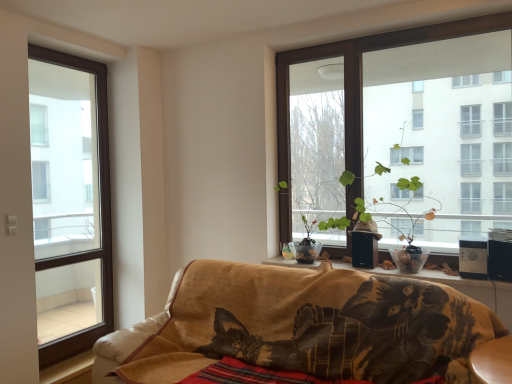
Question: Is brown wooden window at upper right, acting as the 1th window starting from the right, facing away from brown wood window at left, which ranks as the 1th window in left-to-right order?

Choices:
 (A) yes
 (B) no

Answer: (B)

Question: Is brown wooden window at upper right, acting as the 1th window starting from the right, oriented towards brown wood window at left, which ranks as the 1th window in left-to-right order?

Choices:
 (A) yes
 (B) no

Answer: (B)

Question: Is brown wooden window at upper right, acting as the 1th window starting from the right, taller than brown wood window at left, the 2th window from the right?

Choices:
 (A) no
 (B) yes

Answer: (A)

Question: Is brown wooden window at upper right, placed as the 2th window when sorted from left to right, beside brown wood window at left, which ranks as the 1th window in left-to-right order?

Choices:
 (A) yes
 (B) no

Answer: (B)

Question: Can you confirm if brown wooden window at upper right, placed as the 2th window when sorted from left to right, is positioned to the left of brown wood window at left, which ranks as the 1th window in left-to-right order?

Choices:
 (A) no
 (B) yes

Answer: (A)

Question: Considering the positions of point (492, 337) and point (102, 163), is point (492, 337) closer or farther from the camera than point (102, 163)?

Choices:
 (A) farther
 (B) closer

Answer: (B)

Question: Is velvet-like brown cat at lower center in front of or behind brown wood window at left, the 2th window from the right, in the image?

Choices:
 (A) behind
 (B) front

Answer: (B)

Question: In terms of width, does velvet-like brown cat at lower center look wider or thinner when compared to brown wood window at left, the 2th window from the right?

Choices:
 (A) thin
 (B) wide

Answer: (B)

Question: From a real-world perspective, is velvet-like brown cat at lower center positioned above or below brown wood window at left, the 2th window from the right?

Choices:
 (A) below
 (B) above

Answer: (A)

Question: From a real-world perspective, is brown wood window at left, the 2th window from the right, above or below brown wooden window at upper right, placed as the 2th window when sorted from left to right?

Choices:
 (A) above
 (B) below

Answer: (B)

Question: From the image's perspective, relative to brown wooden window at upper right, acting as the 1th window starting from the right, is brown wood window at left, the 2th window from the right, above or below?

Choices:
 (A) above
 (B) below

Answer: (B)

Question: Visually, is brown wood window at left, the 2th window from the right, positioned to the left or to the right of brown wooden window at upper right, placed as the 2th window when sorted from left to right?

Choices:
 (A) right
 (B) left

Answer: (B)

Question: Is brown wood window at left, the 2th window from the right, bigger or smaller than brown wooden window at upper right, placed as the 2th window when sorted from left to right?

Choices:
 (A) small
 (B) big

Answer: (A)

Question: From the image's perspective, relative to velvet-like brown cat at lower center, is green matte plant at center above or below?

Choices:
 (A) above
 (B) below

Answer: (A)

Question: Is green matte plant at center inside or outside of velvet-like brown cat at lower center?

Choices:
 (A) inside
 (B) outside

Answer: (B)